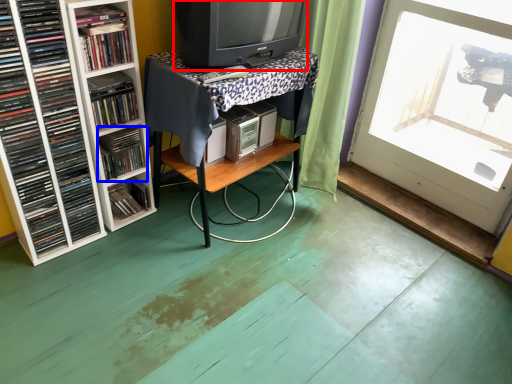
Question: Which object appears farthest to the camera in this image, television (highlighted by a red box) or book (highlighted by a blue box)?

Choices:
 (A) television
 (B) book

Answer: (B)